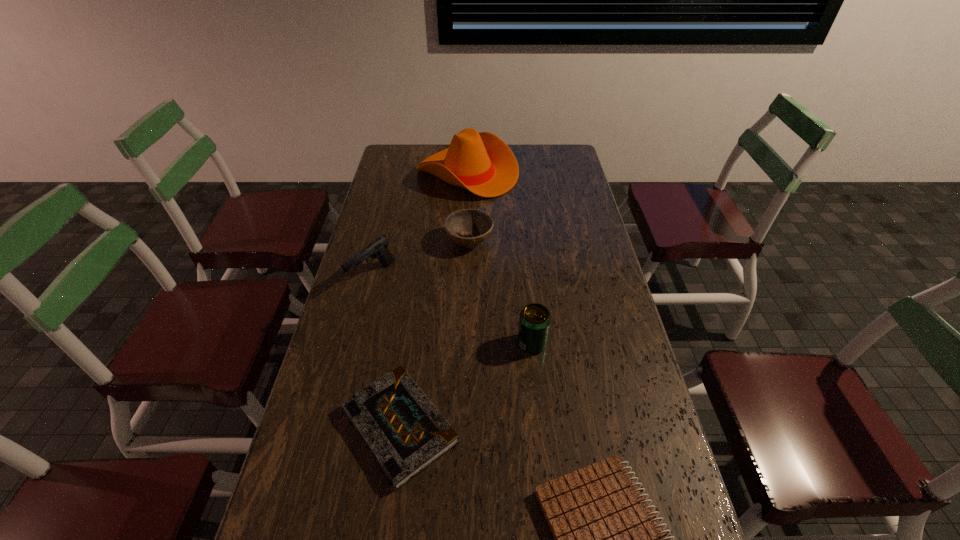
What are the coordinates of `vacant space located at the muzzle of the gun` in the screenshot? It's located at (365, 308).

You are a GUI agent. You are given a task and a screenshot of the screen. Output one action in this format:
    pyautogui.click(x=<x>, y=<y>)
    Task: Click on the vacant region located on the right of the bowl
    This screenshot has width=960, height=540.
    Given the screenshot: What is the action you would take?
    pyautogui.click(x=517, y=241)

Identify the location of free region located 0.090m on the back of the left notebook. (411, 346).

What are the coordinates of `object situated at the far edge` in the screenshot? It's located at (482, 163).

Where is `cowboy hat located at the left edge`? The width and height of the screenshot is (960, 540). cowboy hat located at the left edge is located at coordinates (482, 163).

I want to click on gun situated at the left edge, so click(x=378, y=248).

Where is `notebook present at the left edge`? Image resolution: width=960 pixels, height=540 pixels. notebook present at the left edge is located at coordinates (405, 433).

The width and height of the screenshot is (960, 540). I want to click on object at the far left corner, so click(x=482, y=163).

In the image, there is a desktop. What are the coordinates of `vacant space at the left edge` in the screenshot? It's located at (389, 175).

Locate an element on the screen. The image size is (960, 540). vacant space at the right edge is located at coordinates (578, 213).